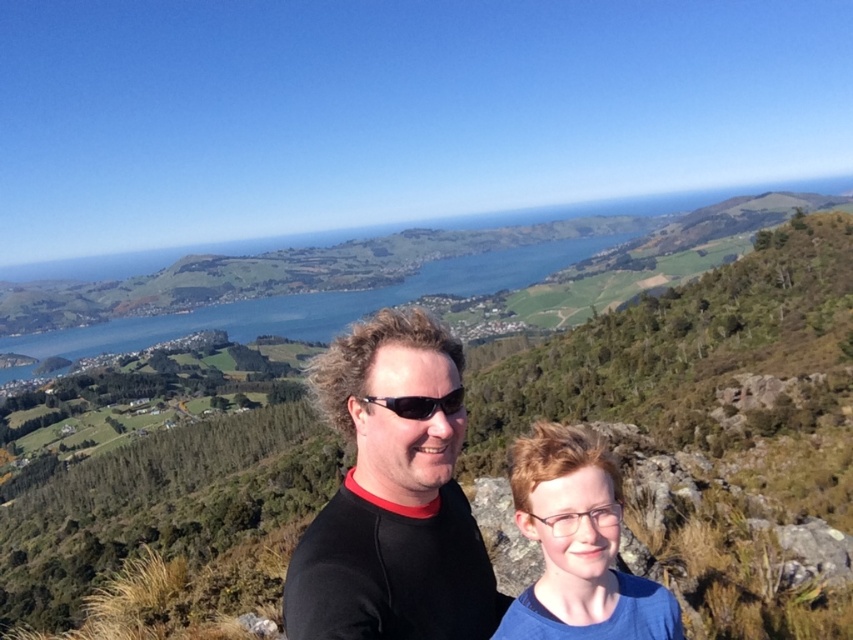
Is black matte shirt at center to the left of black plastic sunglasses at center from the viewer's perspective?

Yes, black matte shirt at center is to the left of black plastic sunglasses at center.

This screenshot has width=853, height=640. What do you see at coordinates (392, 496) in the screenshot?
I see `black matte shirt at center` at bounding box center [392, 496].

Does point (381, 342) come closer to viewer compared to point (386, 396)?

No.

The image size is (853, 640). Find the location of `black matte shirt at center`. black matte shirt at center is located at coordinates (392, 496).

From the picture: Between matte black shirt at center and black plastic sunglasses at center, which one appears on the right side from the viewer's perspective?

Positioned to the right is matte black shirt at center.

Measure the distance between point (532, 467) and camera.

59.41 feet

Image resolution: width=853 pixels, height=640 pixels. What do you see at coordinates (577, 545) in the screenshot?
I see `matte black shirt at center` at bounding box center [577, 545].

Where is `matte black shirt at center`? This screenshot has height=640, width=853. matte black shirt at center is located at coordinates coord(577,545).

Who is more distant from viewer, (350, 625) or (573, 628)?

The point (573, 628) is behind.

Is point (506, 602) positioned after point (550, 522)?

Yes.

I want to click on black matte shirt at center, so click(392, 496).